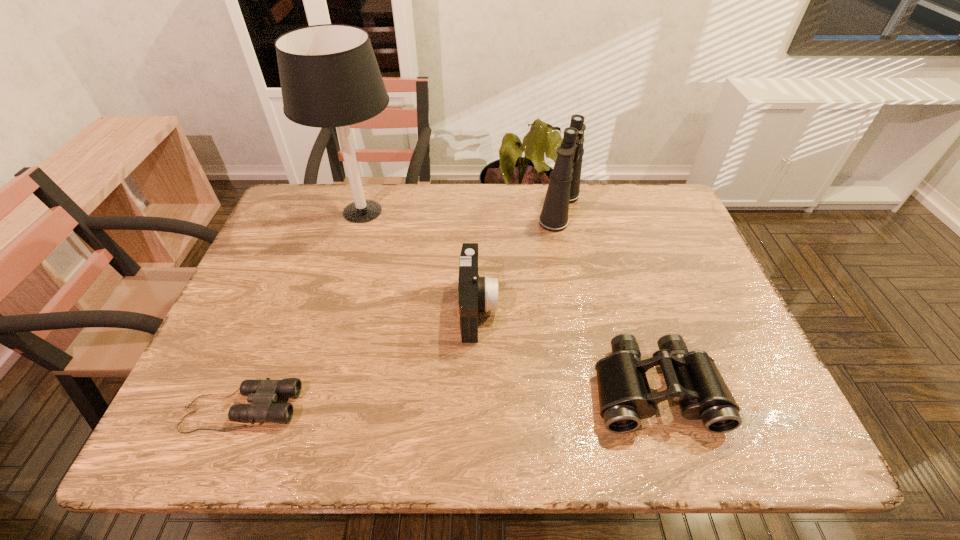
Locate an element on the screen. The image size is (960, 540). free region located on the lens of the camcorder is located at coordinates (539, 308).

Identify the location of free space located 0.090m at the eyepiece of the shortest binoculars. (341, 408).

You are a GUI agent. You are given a task and a screenshot of the screen. Output one action in this format:
    pyautogui.click(x=<x>, y=<y>)
    Task: Click on the table lamp that is at the far edge
    The image size is (960, 540).
    Given the screenshot: What is the action you would take?
    pyautogui.click(x=329, y=75)

I want to click on binoculars that is at the far edge, so click(564, 186).

Where is `table lamp located in the left edge section of the desktop`? This screenshot has height=540, width=960. table lamp located in the left edge section of the desktop is located at coordinates (329, 75).

Locate an element on the screen. This screenshot has width=960, height=540. binoculars located at the left edge is located at coordinates (262, 394).

Identify the location of object located at the right edge. This screenshot has height=540, width=960. (692, 378).

The image size is (960, 540). What are the coordinates of `object that is at the far left corner` in the screenshot? It's located at [329, 75].

In order to click on object that is at the near left corner in this screenshot , I will do `click(262, 394)`.

Identify the location of object that is at the near right corner. (692, 378).